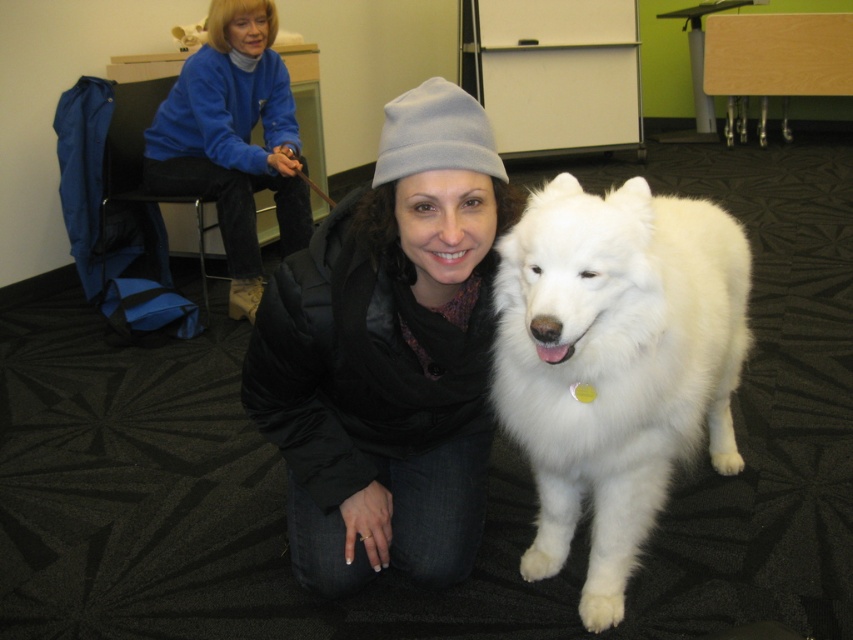
Question: Which of these objects is positioned farthest from the black puffy jacket at center?

Choices:
 (A) white fluffy dog at center
 (B) blue fleece jacket at upper left

Answer: (B)

Question: Is white fluffy dog at center smaller than blue fleece jacket at upper left?

Choices:
 (A) yes
 (B) no

Answer: (B)

Question: Can you confirm if white fluffy dog at center is positioned to the right of blue fleece jacket at upper left?

Choices:
 (A) no
 (B) yes

Answer: (B)

Question: Can you confirm if white fluffy dog at center is bigger than blue fleece jacket at upper left?

Choices:
 (A) yes
 (B) no

Answer: (A)

Question: Which point is farther from the camera taking this photo?

Choices:
 (A) (519, 337)
 (B) (242, 257)

Answer: (B)

Question: Which is nearer to the blue fleece jacket at upper left?

Choices:
 (A) white fluffy dog at center
 (B) black puffy jacket at center

Answer: (B)